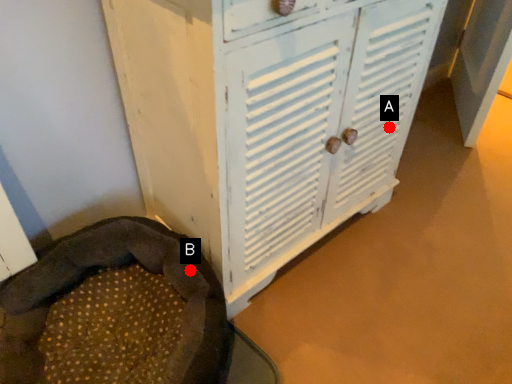
Question: Two points are circled on the image, labeled by A and B beside each circle. Among these points, which one is farthest from the camera?

Choices:
 (A) A is further
 (B) B is further

Answer: (A)